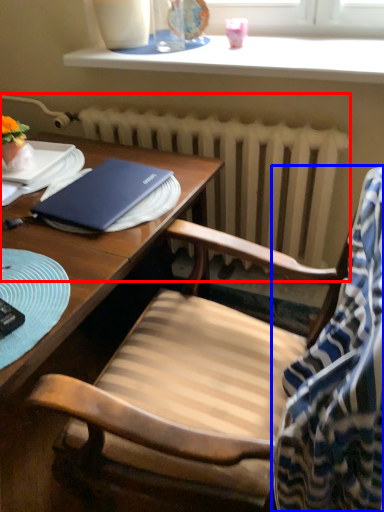
Question: Which object is further to the camera taking this photo, radiator (highlighted by a red box) or blanket (highlighted by a blue box)?

Choices:
 (A) radiator
 (B) blanket

Answer: (A)